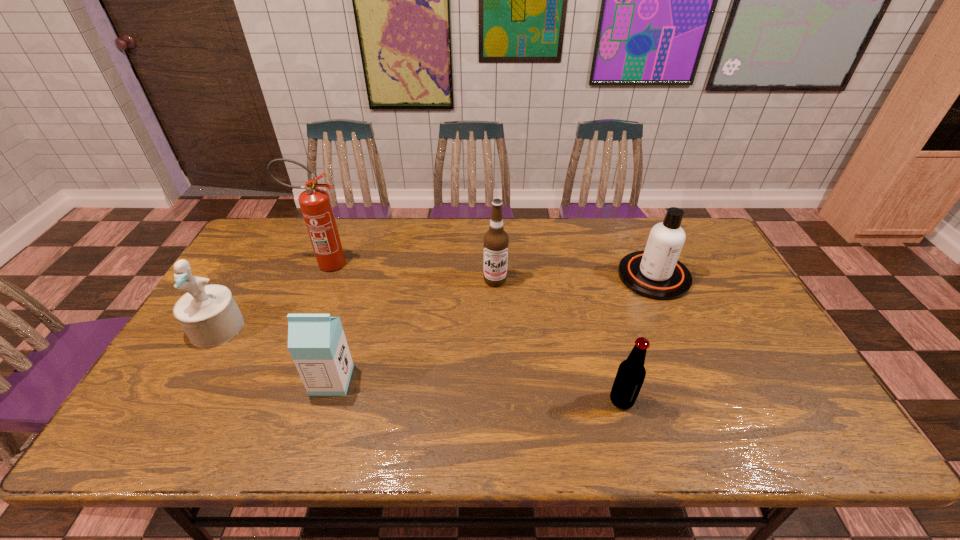
The image size is (960, 540). I want to click on free spot located on the label of the alcohol, so click(496, 318).

Locate an element on the screen. This screenshot has height=540, width=960. vacant space situated at the beak of the fourth farthest object is located at coordinates (175, 401).

This screenshot has height=540, width=960. Identify the location of free space located 0.170m on the left of the cleansing agent. (564, 276).

I want to click on free region located 0.150m on the back of the third object from left to right, so click(349, 322).

Locate an element on the screen. The image size is (960, 540). vacant space located on the left of the beer bottle is located at coordinates (488, 400).

Where is `fire extinguisher present at the far edge`? fire extinguisher present at the far edge is located at coordinates (315, 204).

Identify the location of cleansing agent present at the far edge. This screenshot has width=960, height=540. (656, 273).

Identify the location of object that is at the left edge. The width and height of the screenshot is (960, 540). (208, 314).

Where is `object at the right edge`? object at the right edge is located at coordinates (656, 273).

You are a GUI agent. You are given a task and a screenshot of the screen. Output one action in this format:
    pyautogui.click(x=<x>, y=<y>)
    Task: Click on the object situated at the far right corner
    
    Given the screenshot: What is the action you would take?
    pyautogui.click(x=656, y=273)